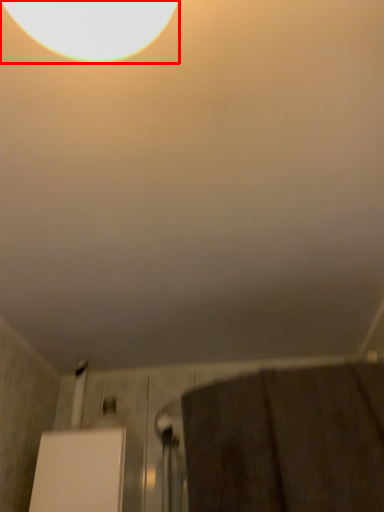
Question: From the image, what is the correct spatial relationship of lamp (annotated by the red box) in relation to bath towel?

Choices:
 (A) left
 (B) right

Answer: (A)